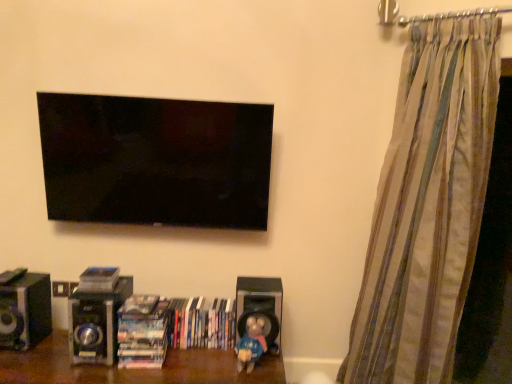
Where is `free spot in front of hardcover books at center, the 2th book when ordered from right to left`? The image size is (512, 384). free spot in front of hardcover books at center, the 2th book when ordered from right to left is located at coordinates (125, 371).